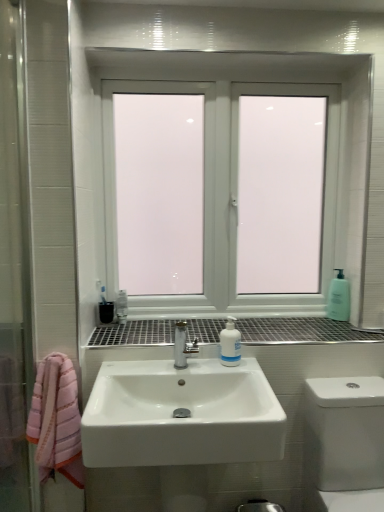
The image size is (384, 512). What are the coordinates of `free space in front of translucent plastic soap dispenser at right` in the screenshot? It's located at (340, 329).